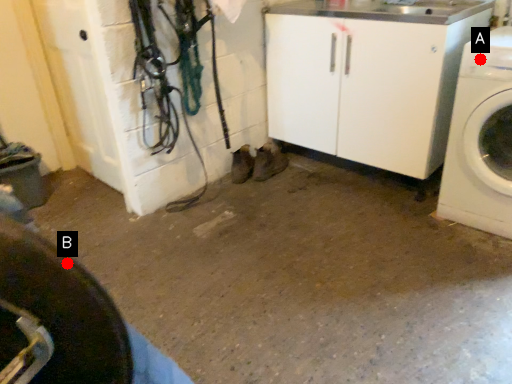
Question: Two points are circled on the image, labeled by A and B beside each circle. Which point is closer to the camera?

Choices:
 (A) A is closer
 (B) B is closer

Answer: (B)